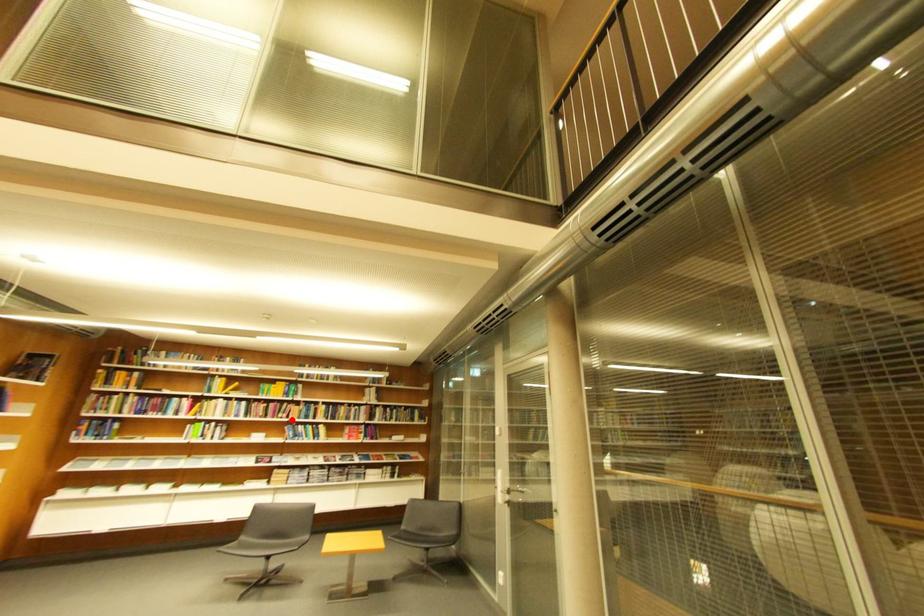
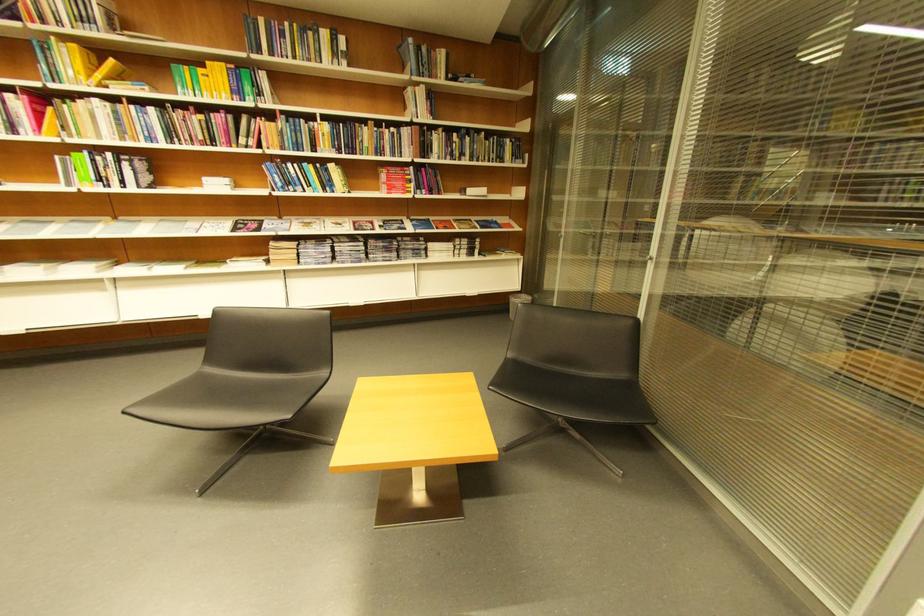
Question: I am providing you with two images of the same scene from different viewpoints. In image1, a red point is highlighted. Considering the same 3D point in image2, which of the following is correct?

Choices:
 (A) It is closer
 (B) It is farther

Answer: (A)